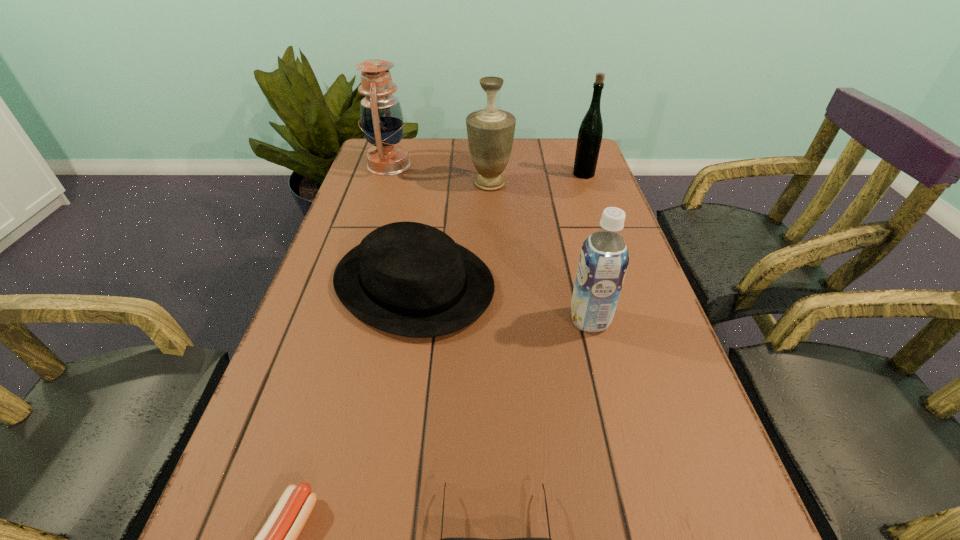
The width and height of the screenshot is (960, 540). In order to click on object that is the fourth closest to the fedora in this screenshot , I will do `click(277, 539)`.

This screenshot has height=540, width=960. I want to click on object that is the sixth closest one to the oil lamp, so click(x=549, y=539).

Locate an element on the screen. free space in the image that satisfies the following two spatial constraints: 1. on the back side of the fedora; 2. on the right side of the beer bottle is located at coordinates (432, 174).